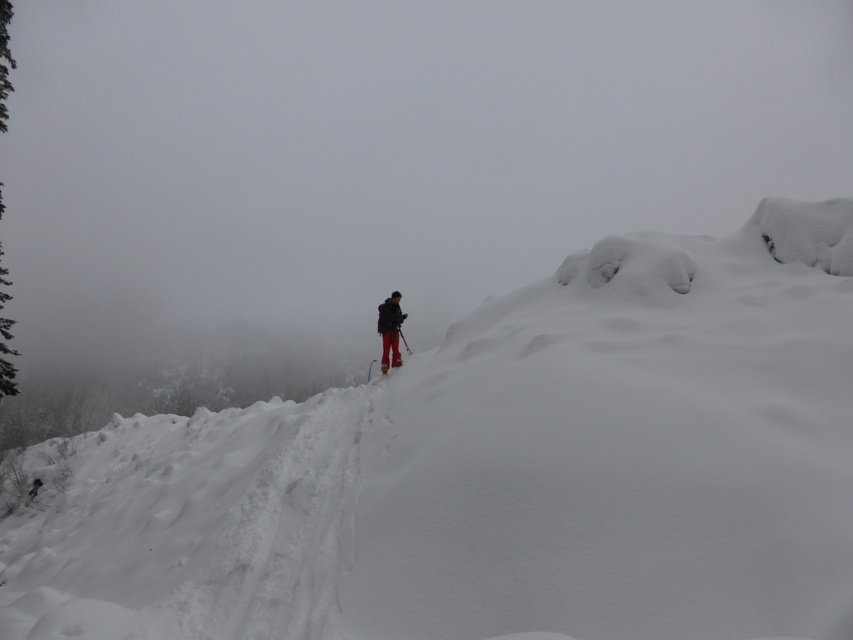
You are planning to take a photo of the dark matte jacket at center and the shiny metallic ski at center in the snowy landscape. Which object should you focus on first if you want to ensure both are in the frame without moving the camera?

The dark matte jacket at center has a smaller size compared to the shiny metallic ski at center, so you should focus on the shiny metallic ski at center first to ensure it fits within the frame before adjusting for the smaller jacket.

From the picture: You are planning to place the shiny metallic ski at center on the white fluffy snow at center. Based on their sizes, will the ski completely cover the snow area?

The white fluffy snow at center might be wider than the shiny metallic ski at center, so the ski may not completely cover the snow area.